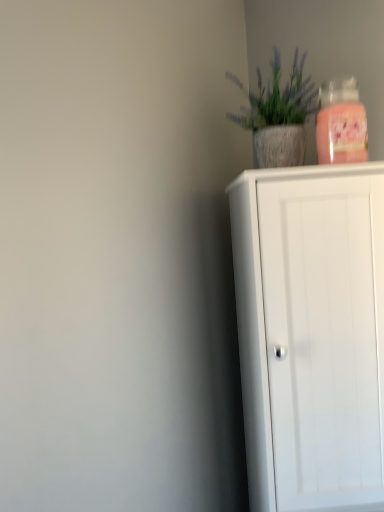
You are a GUI agent. You are given a task and a screenshot of the screen. Output one action in this format:
    pyautogui.click(x=<x>, y=<y>)
    Task: Click on the white matte cabinet at right
    The width and height of the screenshot is (384, 512).
    Given the screenshot: What is the action you would take?
    pyautogui.click(x=311, y=334)

This screenshot has height=512, width=384. What do you see at coordinates (311, 334) in the screenshot? I see `white matte cabinet at right` at bounding box center [311, 334].

What is the approximate width of textured concrete pot at upper right?

textured concrete pot at upper right is 17.49 centimeters in width.

Identify the location of textured concrete pot at upper right. Image resolution: width=384 pixels, height=512 pixels. (278, 115).

Describe the element at coordinates (278, 115) in the screenshot. The image size is (384, 512). I see `textured concrete pot at upper right` at that location.

The height and width of the screenshot is (512, 384). I want to click on white matte cabinet at right, so click(x=311, y=334).

Considering the relative positions of white matte cabinet at right and textured concrete pot at upper right in the image provided, is white matte cabinet at right to the left of textured concrete pot at upper right from the viewer's perspective?

In fact, white matte cabinet at right is to the right of textured concrete pot at upper right.

Considering their positions, is white matte cabinet at right located in front of or behind textured concrete pot at upper right?

Clearly, white matte cabinet at right is in front of textured concrete pot at upper right.

Considering the points (277, 197) and (316, 106), which point is in front, point (277, 197) or point (316, 106)?

The point (277, 197) is closer to the camera.

From the image's perspective, is white matte cabinet at right under textured concrete pot at upper right?

Yes, from the image's perspective, white matte cabinet at right is beneath textured concrete pot at upper right.

From a real-world perspective, is white matte cabinet at right positioned above or below textured concrete pot at upper right?

white matte cabinet at right is below textured concrete pot at upper right.

Between white matte cabinet at right and textured concrete pot at upper right, which one has smaller width?

textured concrete pot at upper right is thinner.

Who is taller, white matte cabinet at right or textured concrete pot at upper right?

white matte cabinet at right.

Which of these two, white matte cabinet at right or textured concrete pot at upper right, is smaller?

With smaller size is textured concrete pot at upper right.

Can textured concrete pot at upper right be found inside white matte cabinet at right?

Actually, textured concrete pot at upper right is outside white matte cabinet at right.

Is white matte cabinet at right far from textured concrete pot at upper right?

No.

Is white matte cabinet at right oriented away from textured concrete pot at upper right?

No.

At what (x,y) coordinates should I click in order to perform the action: click on cupboard below the textured concrete pot at upper right (from a real-world perspective). Please return your answer as a coordinate pair (x, y). Looking at the image, I should click on (311, 334).

Considering the positions of objects textured concrete pot at upper right and white matte cabinet at right in the image provided, who is more to the left, textured concrete pot at upper right or white matte cabinet at right?

From the viewer's perspective, textured concrete pot at upper right appears more on the left side.

Based on the photo, which object is closer to the camera, textured concrete pot at upper right or white matte cabinet at right?

Positioned in front is white matte cabinet at right.

Is point (284, 139) closer or farther from the camera than point (289, 405)?

Clearly, point (284, 139) is more distant from the camera than point (289, 405).

From the image's perspective, which is above, textured concrete pot at upper right or white matte cabinet at right?

textured concrete pot at upper right, from the image's perspective.

Looking at this image, from a real-world perspective, is textured concrete pot at upper right beneath white matte cabinet at right?

Incorrect, from a real-world perspective, textured concrete pot at upper right is higher than white matte cabinet at right.

Is textured concrete pot at upper right wider or thinner than white matte cabinet at right?

Considering their sizes, textured concrete pot at upper right looks slimmer than white matte cabinet at right.

Which of these two, textured concrete pot at upper right or white matte cabinet at right, stands shorter?

textured concrete pot at upper right is shorter.

From the picture: In terms of size, does textured concrete pot at upper right appear bigger or smaller than white matte cabinet at right?

Clearly, textured concrete pot at upper right is smaller in size than white matte cabinet at right.

Do you think textured concrete pot at upper right is within white matte cabinet at right, or outside of it?

textured concrete pot at upper right is outside white matte cabinet at right.

Is textured concrete pot at upper right directly adjacent to white matte cabinet at right?

No, textured concrete pot at upper right is not touching white matte cabinet at right.

Is textured concrete pot at upper right aimed at white matte cabinet at right?

No, textured concrete pot at upper right is not aimed at white matte cabinet at right.

How different are the orientations of textured concrete pot at upper right and white matte cabinet at right in degrees?

The angular difference between textured concrete pot at upper right and white matte cabinet at right is 1.59 degrees.

Measure the distance between textured concrete pot at upper right and white matte cabinet at right.

A distance of 32.86 centimeters exists between textured concrete pot at upper right and white matte cabinet at right.

The image size is (384, 512). Identify the location of cupboard located in front of the textured concrete pot at upper right. (311, 334).

Where is `houseplant above the white matte cabinet at right (from the image's perspective)`? The height and width of the screenshot is (512, 384). houseplant above the white matte cabinet at right (from the image's perspective) is located at coordinates (278, 115).

Locate an element on the screen. The image size is (384, 512). cupboard in front of the textured concrete pot at upper right is located at coordinates (311, 334).